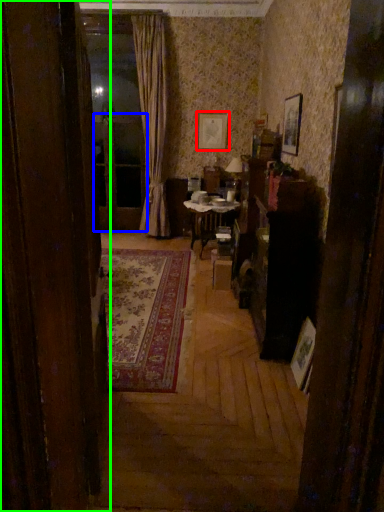
Question: Which is nearer to the picture frame (highlighted by a red box)? screen door (highlighted by a blue box) or door (highlighted by a green box).

Choices:
 (A) screen door
 (B) door

Answer: (A)